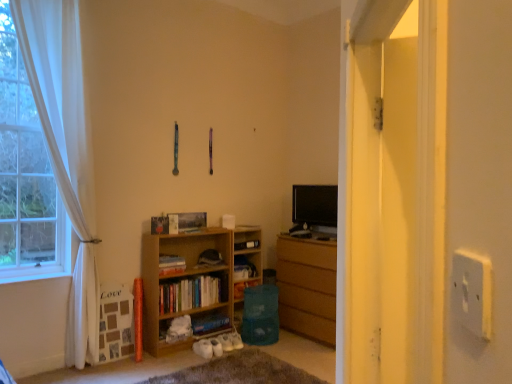
Question: Can you confirm if wooden chest of drawers at center is taller than transparent plastic screen door at right?

Choices:
 (A) yes
 (B) no

Answer: (B)

Question: Is wooden chest of drawers at center at the right side of transparent plastic screen door at right?

Choices:
 (A) yes
 (B) no

Answer: (A)

Question: Is wooden chest of drawers at center located outside transparent plastic screen door at right?

Choices:
 (A) no
 (B) yes

Answer: (B)

Question: Would you say transparent plastic screen door at right is part of wooden chest of drawers at center's contents?

Choices:
 (A) no
 (B) yes

Answer: (A)

Question: From a real-world perspective, is wooden chest of drawers at center on transparent plastic screen door at right?

Choices:
 (A) yes
 (B) no

Answer: (B)

Question: Is wooden bookshelf at center, which is the 2th book from top to bottom, situated inside hardcover book at lower center, arranged as the first book when ordered from the bottom, or outside?

Choices:
 (A) outside
 (B) inside

Answer: (A)

Question: Considering the positions of wooden bookshelf at center, placed as the 2th book when sorted from bottom to top, and hardcover book at lower center, positioned as the 3th book in top-to-bottom order, in the image, is wooden bookshelf at center, placed as the 2th book when sorted from bottom to top, wider or thinner than hardcover book at lower center, positioned as the 3th book in top-to-bottom order,?

Choices:
 (A) thin
 (B) wide

Answer: (A)

Question: From a real-world perspective, is wooden bookshelf at center, placed as the 2th book when sorted from bottom to top, above or below hardcover book at lower center, positioned as the 3th book in top-to-bottom order?

Choices:
 (A) above
 (B) below

Answer: (A)

Question: Does point (181, 281) appear closer or farther from the camera than point (203, 321)?

Choices:
 (A) closer
 (B) farther

Answer: (A)

Question: Would you say hardcover book at center, which appears as the first book when viewed from the top, is to the left or to the right of wooden bookshelf at center in the picture?

Choices:
 (A) right
 (B) left

Answer: (B)

Question: Considering the positions of hardcover book at center, which appears as the first book when viewed from the top, and wooden bookshelf at center in the image, is hardcover book at center, which appears as the first book when viewed from the top, wider or thinner than wooden bookshelf at center?

Choices:
 (A) thin
 (B) wide

Answer: (B)

Question: From a real-world perspective, is hardcover book at center, which appears as the first book when viewed from the top, positioned above or below wooden bookshelf at center?

Choices:
 (A) above
 (B) below

Answer: (A)

Question: Is point (169, 263) closer or farther from the camera than point (233, 292)?

Choices:
 (A) closer
 (B) farther

Answer: (A)

Question: Considering the positions of hardcover book at lower center, positioned as the 3th book in top-to-bottom order, and black glossy tv at center in the image, is hardcover book at lower center, positioned as the 3th book in top-to-bottom order, wider or thinner than black glossy tv at center?

Choices:
 (A) wide
 (B) thin

Answer: (A)

Question: Is hardcover book at lower center, positioned as the 3th book in top-to-bottom order, in front of or behind black glossy tv at center in the image?

Choices:
 (A) front
 (B) behind

Answer: (A)